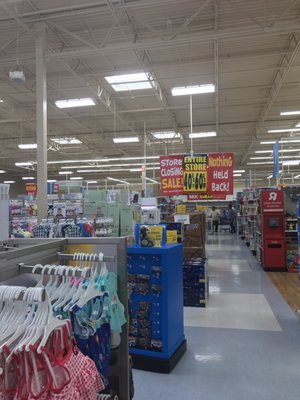
At what (x,y) coordinates should I click in order to perform the action: click on tiled floor. Please return your answer as a coordinate pair (x, y). Image resolution: width=300 pixels, height=400 pixels. Looking at the image, I should click on (234, 351).